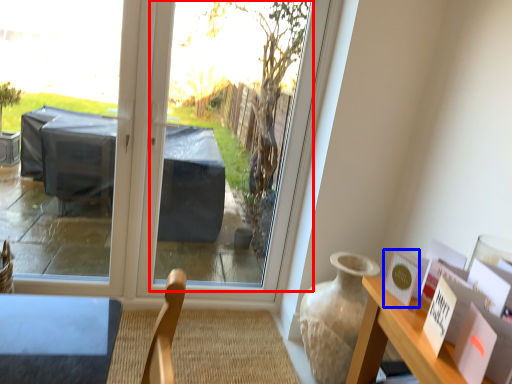
Question: Among these objects, which one is nearest to the camera, window screen (highlighted by a red box) or postcard (highlighted by a blue box)?

Choices:
 (A) window screen
 (B) postcard

Answer: (B)